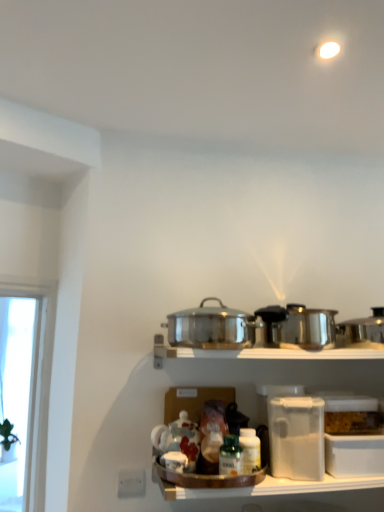
Measure the distance between clear plastic container at lower right and camera.

clear plastic container at lower right is 4.10 feet from camera.

Find the location of `shiny metallic crock pot at right, the 2th crock pot in the left-to-right sequence`. shiny metallic crock pot at right, the 2th crock pot in the left-to-right sequence is located at coordinates (362, 331).

Considering the relative sizes of shiny metallic crock pot at right, the 2th crock pot in the left-to-right sequence, and green glass bottle at center in the image provided, is shiny metallic crock pot at right, the 2th crock pot in the left-to-right sequence, bigger than green glass bottle at center?

Yes.

In the scene shown: Is shiny metallic crock pot at right, which ranks as the 1th crock pot in right-to-left order, positioned with its back to green glass bottle at center?

No, shiny metallic crock pot at right, which ranks as the 1th crock pot in right-to-left order, is not facing away from green glass bottle at center.

Who is taller, shiny metallic crock pot at right, which ranks as the 1th crock pot in right-to-left order, or green glass bottle at center?

shiny metallic crock pot at right, which ranks as the 1th crock pot in right-to-left order.

Is point (377, 324) closer to viewer compared to point (228, 472)?

No, it is behind (228, 472).

Is green glass bottle at center positioned with its back to polished stainless steel pot at center, the first crock pot from the left?

No, polished stainless steel pot at center, the first crock pot from the left, is not at the back of green glass bottle at center.

In the image, there is a polished stainless steel pot at center, the first crock pot from the left. Where is `bottle below it (from a real-world perspective)`? bottle below it (from a real-world perspective) is located at coordinates (230, 457).

Based on the photo, considering the relative sizes of green glass bottle at center and polished stainless steel pot at center, the first crock pot from the left, in the image provided, is green glass bottle at center thinner than polished stainless steel pot at center, the first crock pot from the left,?

Yes, green glass bottle at center is thinner than polished stainless steel pot at center, the first crock pot from the left.

Can you confirm if green glass bottle at center is taller than polished stainless steel pot at center, the second crock pot from the right?

Incorrect, the height of green glass bottle at center is not larger of that of polished stainless steel pot at center, the second crock pot from the right.

Find the location of a particular element. bottle lying on the left of clear plastic container at lower right is located at coordinates (230, 457).

Does green glass bottle at center lie behind clear plastic container at lower right?

Yes, it is.

Is point (240, 448) positioned in front of point (316, 442)?

Yes, point (240, 448) is in front of point (316, 442).

Where is `crock pot lying below the polished stainless steel pot at center, the first crock pot from the left (from the image's perspective)`? Image resolution: width=384 pixels, height=512 pixels. crock pot lying below the polished stainless steel pot at center, the first crock pot from the left (from the image's perspective) is located at coordinates (362, 331).

Could you tell me if shiny metallic crock pot at right, the 2th crock pot in the left-to-right sequence, is facing polished stainless steel pot at center, the first crock pot from the left?

No, shiny metallic crock pot at right, the 2th crock pot in the left-to-right sequence, is not aimed at polished stainless steel pot at center, the first crock pot from the left.

Between shiny metallic crock pot at right, the 2th crock pot in the left-to-right sequence, and polished stainless steel pot at center, the second crock pot from the right, which one has more height?

Standing taller between the two is polished stainless steel pot at center, the second crock pot from the right.

Measure the distance between shiny metallic crock pot at right, which ranks as the 1th crock pot in right-to-left order, and polished stainless steel pot at center, the first crock pot from the left.

shiny metallic crock pot at right, which ranks as the 1th crock pot in right-to-left order, and polished stainless steel pot at center, the first crock pot from the left, are 45.20 centimeters apart from each other.

Measure the distance from shiny metallic crock pot at right, the 2th crock pot in the left-to-right sequence, to clear plastic container at lower right.

They are 14.64 inches apart.

Considering the relative positions of shiny metallic crock pot at right, which ranks as the 1th crock pot in right-to-left order, and clear plastic container at lower right in the image provided, is shiny metallic crock pot at right, which ranks as the 1th crock pot in right-to-left order, to the left of clear plastic container at lower right from the viewer's perspective?

No, shiny metallic crock pot at right, which ranks as the 1th crock pot in right-to-left order, is not to the left of clear plastic container at lower right.

Is shiny metallic crock pot at right, the 2th crock pot in the left-to-right sequence, positioned far away from clear plastic container at lower right?

No, shiny metallic crock pot at right, the 2th crock pot in the left-to-right sequence, is not far from clear plastic container at lower right.

You are a GUI agent. You are given a task and a screenshot of the screen. Output one action in this format:
    pyautogui.click(x=<x>, y=<y>)
    Task: Click on the appliance that appears on the left of shiny metallic crock pot at right, which ranks as the 1th crock pot in right-to-left order
    
    Given the screenshot: What is the action you would take?
    pyautogui.click(x=296, y=437)

From a real-world perspective, is green glass bottle at center physically above shiny metallic crock pot at right, the 2th crock pot in the left-to-right sequence?

Actually, green glass bottle at center is physically below shiny metallic crock pot at right, the 2th crock pot in the left-to-right sequence, in the real world.

Is green glass bottle at center with shiny metallic crock pot at right, which ranks as the 1th crock pot in right-to-left order?

green glass bottle at center and shiny metallic crock pot at right, which ranks as the 1th crock pot in right-to-left order, are clearly separated.

Is green glass bottle at center turned away from shiny metallic crock pot at right, which ranks as the 1th crock pot in right-to-left order?

That's not correct — green glass bottle at center is not looking away from shiny metallic crock pot at right, which ranks as the 1th crock pot in right-to-left order.

From the image's perspective, is green glass bottle at center located beneath shiny metallic crock pot at right, the 2th crock pot in the left-to-right sequence?

Correct, green glass bottle at center appears lower than shiny metallic crock pot at right, the 2th crock pot in the left-to-right sequence, in the image.

From a real-world perspective, between polished stainless steel pot at center, the first crock pot from the left, and shiny metallic crock pot at right, which ranks as the 1th crock pot in right-to-left order, who is vertically lower?

polished stainless steel pot at center, the first crock pot from the left.

Where is `crock pot that appears below the shiny metallic crock pot at right, which ranks as the 1th crock pot in right-to-left order (from a real-world perspective)`? Image resolution: width=384 pixels, height=512 pixels. crock pot that appears below the shiny metallic crock pot at right, which ranks as the 1th crock pot in right-to-left order (from a real-world perspective) is located at coordinates (211, 327).

Can we say polished stainless steel pot at center, the second crock pot from the right, lies outside shiny metallic crock pot at right, which ranks as the 1th crock pot in right-to-left order?

That's correct, polished stainless steel pot at center, the second crock pot from the right, is outside of shiny metallic crock pot at right, which ranks as the 1th crock pot in right-to-left order.

From a real-world perspective, count 2nd crock pots upward from the green glass bottle at center and point to it. Please provide its 2D coordinates.

[(362, 331)]

Find the location of a particular element. The height and width of the screenshot is (512, 384). bottle below the polished stainless steel pot at center, the first crock pot from the left (from a real-world perspective) is located at coordinates (230, 457).

Estimate the real-world distances between objects in this image. Which object is further from polished stainless steel pot at center, the second crock pot from the right, shiny metallic crock pot at right, the 2th crock pot in the left-to-right sequence, or green glass bottle at center?

shiny metallic crock pot at right, the 2th crock pot in the left-to-right sequence, is further to polished stainless steel pot at center, the second crock pot from the right.

From the image, which object appears to be farther from polished stainless steel pot at center, the first crock pot from the left, green glass bottle at center or clear plastic container at lower right?

green glass bottle at center.

Which object lies further to the anchor point green glass bottle at center, clear plastic container at lower right or shiny metallic crock pot at right, which ranks as the 1th crock pot in right-to-left order?

shiny metallic crock pot at right, which ranks as the 1th crock pot in right-to-left order, is further to green glass bottle at center.

Based on their spatial positions, is clear plastic container at lower right or polished stainless steel pot at center, the first crock pot from the left, closer to shiny metallic crock pot at right, the 2th crock pot in the left-to-right sequence?

clear plastic container at lower right lies closer to shiny metallic crock pot at right, the 2th crock pot in the left-to-right sequence, than the other object.

Based on their spatial positions, is polished stainless steel pot at center, the second crock pot from the right, or shiny metallic crock pot at right, the 2th crock pot in the left-to-right sequence, further from clear plastic container at lower right?

Among the two, shiny metallic crock pot at right, the 2th crock pot in the left-to-right sequence, is located further to clear plastic container at lower right.

Estimate the real-world distances between objects in this image. Which object is closer to shiny metallic crock pot at right, the 2th crock pot in the left-to-right sequence, clear plastic container at lower right or green glass bottle at center?

Among the two, clear plastic container at lower right is located nearer to shiny metallic crock pot at right, the 2th crock pot in the left-to-right sequence.

Which object lies further to the anchor point clear plastic container at lower right, green glass bottle at center or polished stainless steel pot at center, the second crock pot from the right?

polished stainless steel pot at center, the second crock pot from the right, is positioned further to the anchor clear plastic container at lower right.

Based on their spatial positions, is polished stainless steel pot at center, the first crock pot from the left, or clear plastic container at lower right further from shiny metallic crock pot at right, which ranks as the 1th crock pot in right-to-left order?

polished stainless steel pot at center, the first crock pot from the left, is positioned further to the anchor shiny metallic crock pot at right, which ranks as the 1th crock pot in right-to-left order.

Find the location of a particular element. appliance between green glass bottle at center and shiny metallic crock pot at right, which ranks as the 1th crock pot in right-to-left order, in the horizontal direction is located at coordinates (296, 437).

This screenshot has height=512, width=384. I want to click on appliance between polished stainless steel pot at center, the second crock pot from the right, and green glass bottle at center, in the vertical direction, so click(296, 437).

You are a GUI agent. You are given a task and a screenshot of the screen. Output one action in this format:
    pyautogui.click(x=<x>, y=<y>)
    Task: Click on the bottle between polished stainless steel pot at center, the first crock pot from the left, and shiny metallic crock pot at right, which ranks as the 1th crock pot in right-to-left order, from left to right
    Image resolution: width=384 pixels, height=512 pixels.
    Given the screenshot: What is the action you would take?
    pyautogui.click(x=230, y=457)

I want to click on appliance located between polished stainless steel pot at center, the second crock pot from the right, and shiny metallic crock pot at right, which ranks as the 1th crock pot in right-to-left order, in the left-right direction, so click(x=296, y=437).